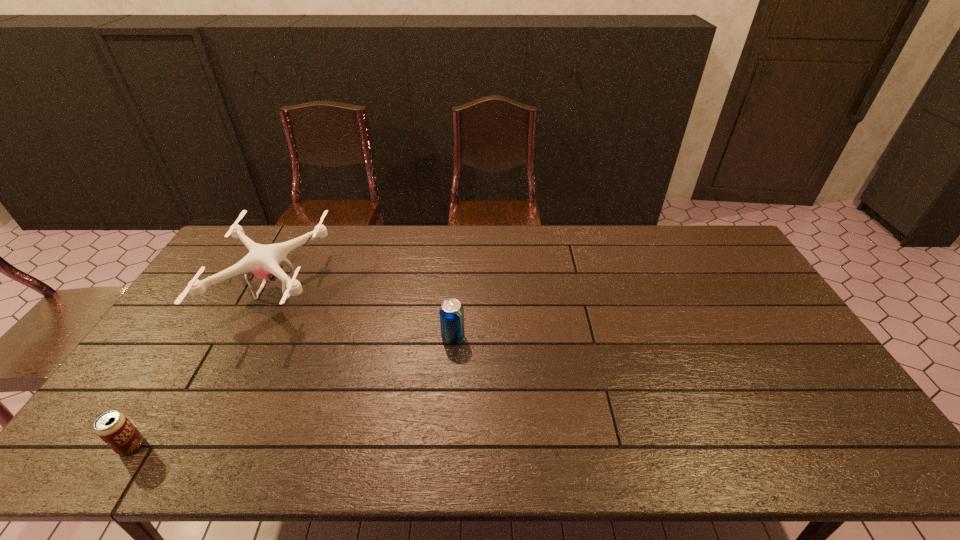
Image resolution: width=960 pixels, height=540 pixels. Identify the location of drone positioned at the left edge. (262, 261).

Identify the location of beer can that is at the left edge. This screenshot has height=540, width=960. (114, 428).

Where is `object that is at the far left corner`? Image resolution: width=960 pixels, height=540 pixels. object that is at the far left corner is located at coordinates (262, 261).

At what (x,y) coordinates should I click in order to perform the action: click on object positioned at the near left corner. Please return your answer as a coordinate pair (x, y). The height and width of the screenshot is (540, 960). Looking at the image, I should click on (114, 428).

Locate an element on the screen. This screenshot has width=960, height=540. vacant space at the far edge of the desktop is located at coordinates (323, 243).

Identify the location of vacant space at the near edge of the desktop. (335, 430).

You are a GUI agent. You are given a task and a screenshot of the screen. Output one action in this format:
    pyautogui.click(x=<x>, y=<y>)
    Task: Click on the vacant space at the right edge of the desktop
    Image resolution: width=960 pixels, height=540 pixels.
    Given the screenshot: What is the action you would take?
    pyautogui.click(x=787, y=386)

This screenshot has height=540, width=960. Identify the location of free space at the far right corner of the desktop. pos(698,242).

Identify the location of vacant space at the near right corner of the desktop. (875, 462).

I want to click on free space between the drone and the shorter beer can, so click(204, 368).